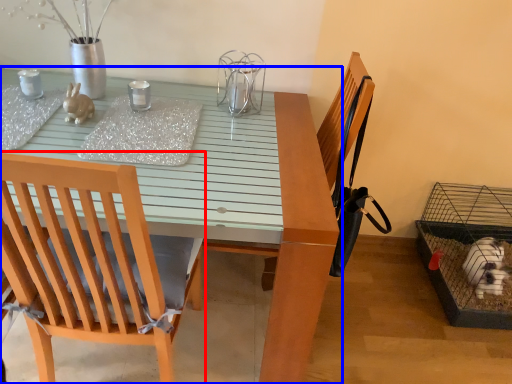
Question: Which of the following is the closest to the observer, chair (highlighted by a red box) or table (highlighted by a blue box)?

Choices:
 (A) chair
 (B) table

Answer: (A)